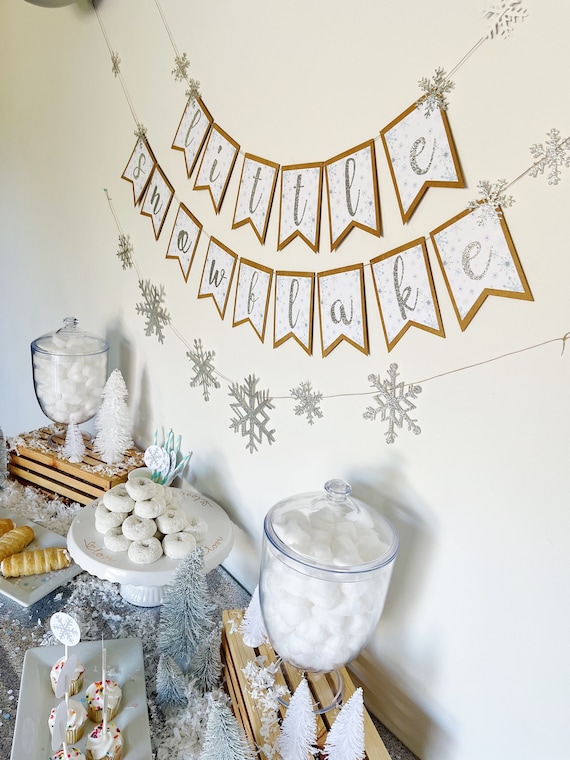
Identify the location of white wall. (256, 124).